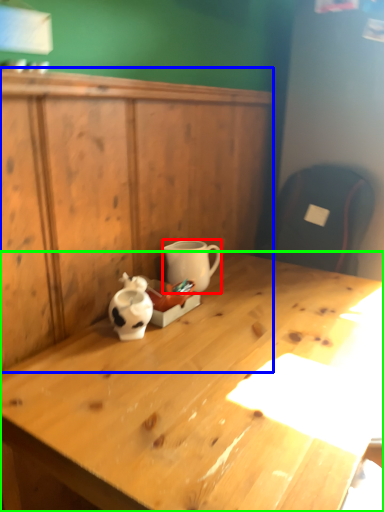
Question: Based on their relative distances, which object is farther from coffee cup (highlighted by a red box)? Choose from dresser (highlighted by a blue box) and desk (highlighted by a green box).

Choices:
 (A) dresser
 (B) desk

Answer: (B)